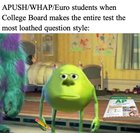
Where is `poster`? poster is located at coordinates (126, 108).